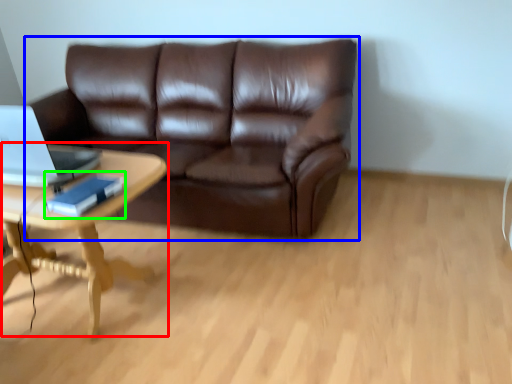
Question: Based on their relative distances, which object is nearer to coffee table (highlighted by a red box)? Choose from studio couch (highlighted by a blue box) and book (highlighted by a green box).

Choices:
 (A) studio couch
 (B) book

Answer: (B)